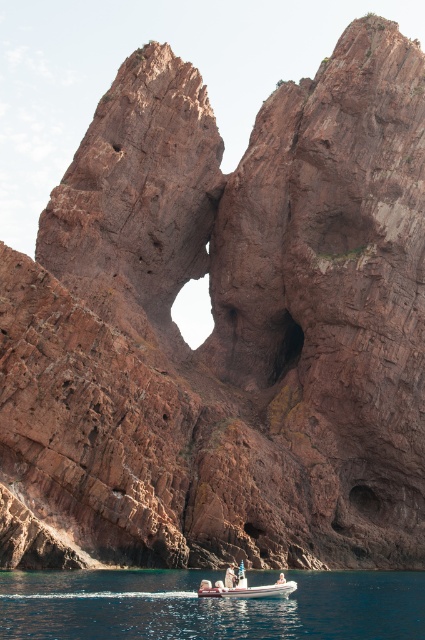
Question: Does rubber dinghy at center appear over light brown wooden paddle at center?

Choices:
 (A) yes
 (B) no

Answer: (B)

Question: Is clear blue water at lower center further to camera compared to light brown wooden paddle at center?

Choices:
 (A) yes
 (B) no

Answer: (B)

Question: Among these points, which one is farthest from the camera?

Choices:
 (A) (51, 616)
 (B) (234, 580)
 (C) (251, 595)

Answer: (B)

Question: Where is rubber dinghy at center located in relation to light brown wooden paddle at center in the image?

Choices:
 (A) right
 (B) left

Answer: (A)

Question: Which object appears closest to the camera in this image?

Choices:
 (A) clear blue water at lower center
 (B) rubber dinghy at center
 (C) light brown wooden paddle at center

Answer: (A)

Question: Based on their relative distances, which object is nearer to the rubber dinghy at center?

Choices:
 (A) light brown wooden paddle at center
 (B) clear blue water at lower center

Answer: (A)